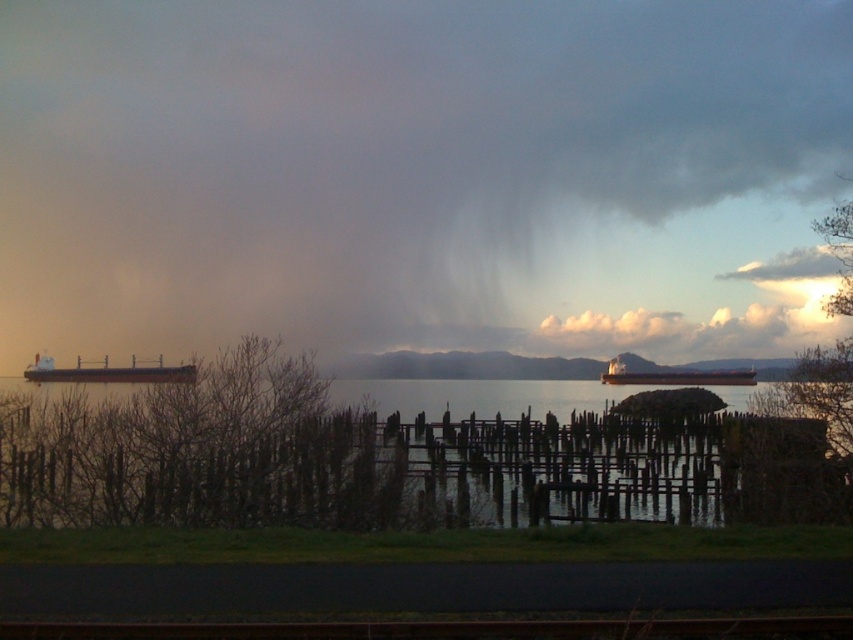
You are standing at the grassy area near the wooden fence in the coastal scene. You need to cross to the other side. The black metal train track at center and the brown matte cargo ship at left are in your path. Which object is closer to you, requiring you to navigate around it first?

The black metal train track at center is positioned under the brown matte cargo ship at left, meaning the train track is closer to you. You should navigate around the black metal train track at center first before dealing with the ship.

You are a photographer planning to capture the entire scene in one shot. Given that the black metal train track at center and the brown matte cargo ship at left are both in your frame, which object will require you to adjust your camera angle to include its full length?

The brown matte cargo ship at left requires adjusting the camera angle because it is longer than the black metal train track at center.